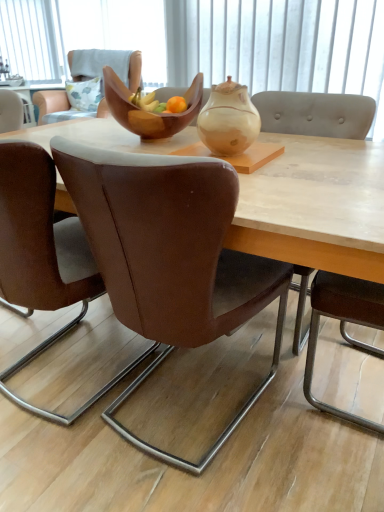
Question: Is wooden bowl at center wider than brown leather chair at center, arranged as the 3th chair when viewed from the front?

Choices:
 (A) yes
 (B) no

Answer: (A)

Question: Is wooden bowl at center shorter than brown leather chair at center, arranged as the 3th chair when viewed from the front?

Choices:
 (A) no
 (B) yes

Answer: (B)

Question: From a real-world perspective, is wooden bowl at center below brown leather chair at center, arranged as the 3th chair when viewed from the front?

Choices:
 (A) no
 (B) yes

Answer: (B)

Question: Could you tell me if wooden bowl at center is turned towards brown leather chair at center, arranged as the 3th chair when viewed from the front?

Choices:
 (A) yes
 (B) no

Answer: (A)

Question: Does wooden bowl at center contain brown leather chair at center, arranged as the 3th chair when viewed from the front?

Choices:
 (A) no
 (B) yes

Answer: (B)

Question: Considering the relative positions of wooden bowl at center and brown leather chair at center, arranged as the 3th chair when viewed from the front, in the image provided, is wooden bowl at center to the left of brown leather chair at center, arranged as the 3th chair when viewed from the front, from the viewer's perspective?

Choices:
 (A) no
 (B) yes

Answer: (A)

Question: Is white fabric at upper center not within matte beige teapot at center?

Choices:
 (A) no
 (B) yes

Answer: (B)

Question: From the image's perspective, would you say white fabric at upper center is positioned over matte beige teapot at center?

Choices:
 (A) no
 (B) yes

Answer: (B)

Question: Is white fabric at upper center to the left of matte beige teapot at center from the viewer's perspective?

Choices:
 (A) no
 (B) yes

Answer: (B)

Question: Could you tell me if white fabric at upper center is facing matte beige teapot at center?

Choices:
 (A) yes
 (B) no

Answer: (B)

Question: From the image's perspective, would you say white fabric at upper center is shown under matte beige teapot at center?

Choices:
 (A) no
 (B) yes

Answer: (A)

Question: Is the position of white fabric at upper center more distant than that of matte beige teapot at center?

Choices:
 (A) no
 (B) yes

Answer: (B)

Question: Considering the relative sizes of brown leather chair at center, arranged as the 3th chair when viewed from the front, and brown leather chair at center, the 4th chair viewed from the front, in the image provided, is brown leather chair at center, arranged as the 3th chair when viewed from the front, thinner than brown leather chair at center, the 4th chair viewed from the front,?

Choices:
 (A) no
 (B) yes

Answer: (B)